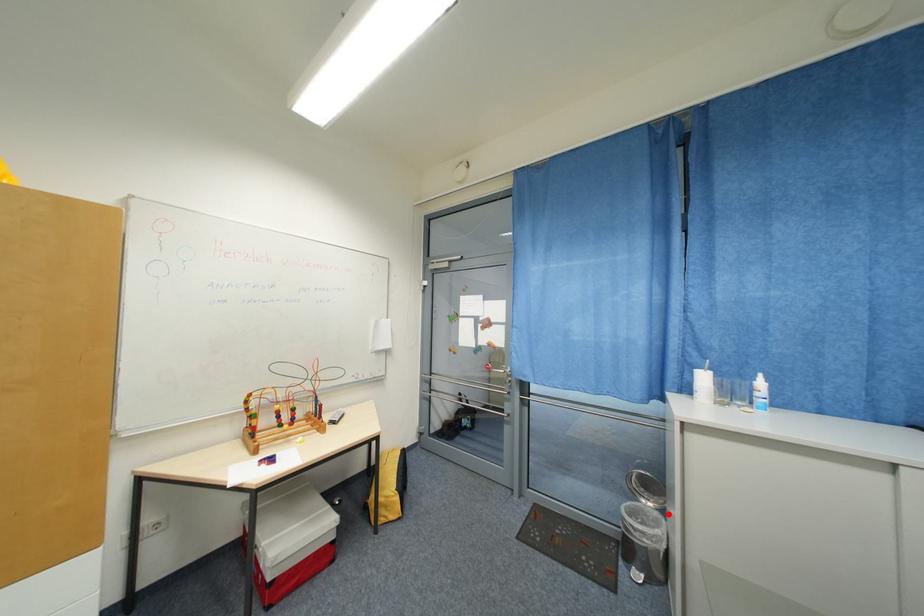
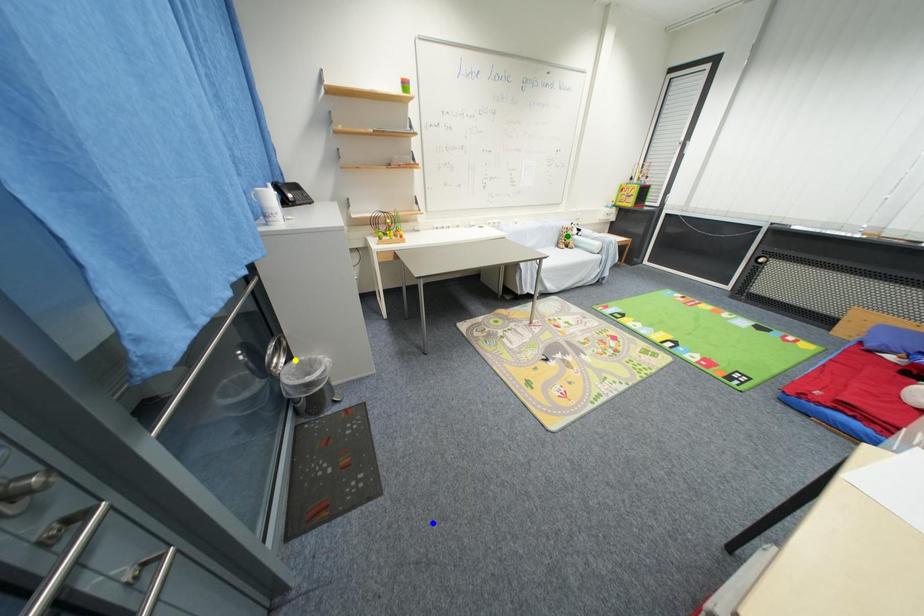
Question: I am providing you with two images of the same scene from different viewpoints. A red point is marked on the first image. You are given multiple points on the second image. Which point in image 2 is actually the same real-world point as the red point in image 1?

Choices:
 (A) yellow point
 (B) green point
 (C) blue point

Answer: (A)